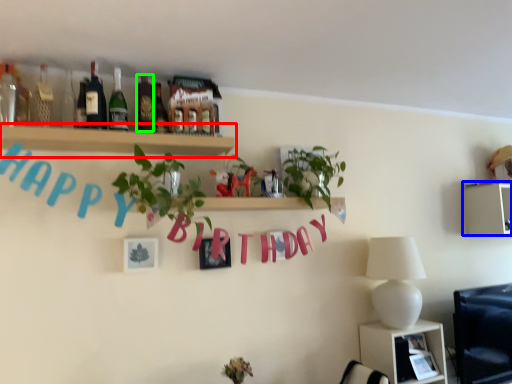
Question: Which object is positioned closest to shelf (highlighted by a red box)? Select from shelf (highlighted by a blue box) and bottle (highlighted by a green box).

Choices:
 (A) shelf
 (B) bottle

Answer: (B)